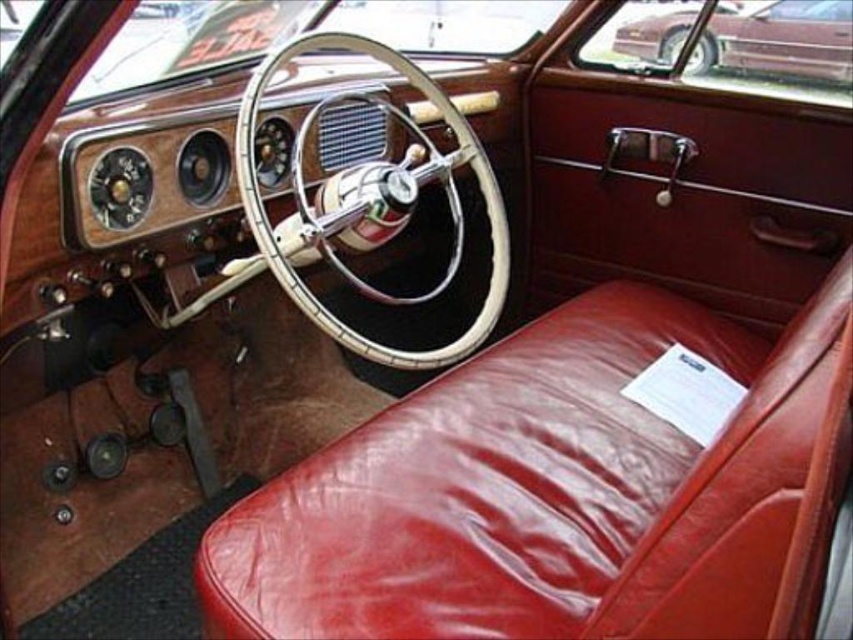
You are standing 1.5 meters away from the car. The point at (386,611) is part of the car door. Can you reach it without moving closer?

The point at (386,611) is 1.16 meters away from the camera. Since you are standing 1.5 meters away from the car, you are farther than the point, so you cannot reach it without moving closer.

You are a delivery robot with a box that is 1 meter wide. You need to move from the shiny leather seat at center to the shiny maroon sedan at upper right. Can your box fit through the space between them?

The distance between the shiny leather seat at center and the shiny maroon sedan at upper right is 1.06 meters. Since the box is 1 meter wide, it can fit through the space between them as there is enough clearance.

You are a passenger entering the car and need to reach the shiny maroon sedan at upper right. Which direction should you move relative to the shiny leather seat at center?

To reach the shiny maroon sedan at upper right, you should move upward from the shiny leather seat at center since it is located below the sedan.